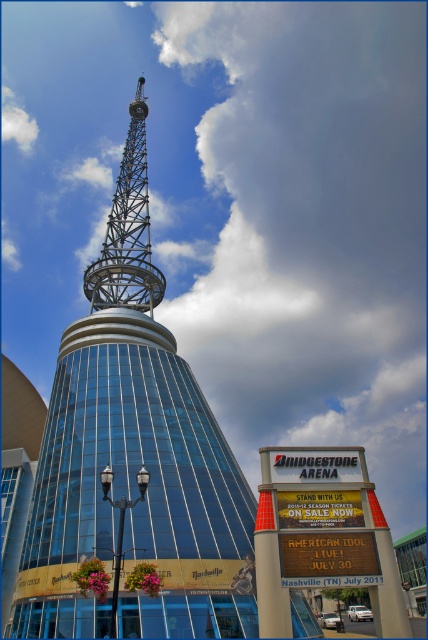
You are standing at the entrance of Bridgestone Arena in Nashville, looking at the tall glass building with a tower. There is a point marked at coordinates (122,461). What does this point represent?

The point at (122,461) represents the metallic structure at upper center, which is part of the tower on the glass building.

What are the coordinates of the metallic structure at upper center in the image?

The metallic structure at upper center is located at coordinates point (122, 461).